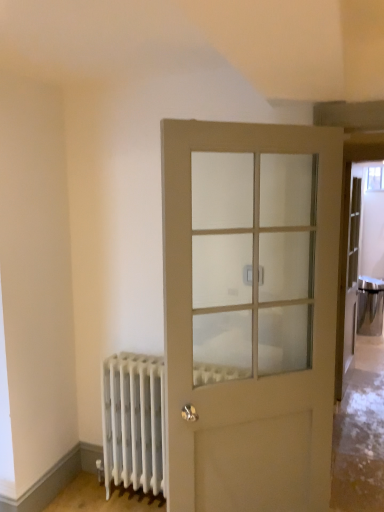
Question: Is white matte radiator at lower left positioned in front of satin silver door handle at center?

Choices:
 (A) yes
 (B) no

Answer: (B)

Question: Is white matte radiator at lower left placed right next to satin silver door handle at center?

Choices:
 (A) no
 (B) yes

Answer: (A)

Question: From a real-world perspective, is white matte radiator at lower left below satin silver door handle at center?

Choices:
 (A) yes
 (B) no

Answer: (A)

Question: From the image's perspective, is white matte radiator at lower left under satin silver door handle at center?

Choices:
 (A) yes
 (B) no

Answer: (A)

Question: From the image's perspective, is white matte radiator at lower left located above satin silver door handle at center?

Choices:
 (A) no
 (B) yes

Answer: (A)

Question: Does white matte radiator at lower left turn towards satin silver door handle at center?

Choices:
 (A) yes
 (B) no

Answer: (B)

Question: From the image's perspective, does matte white door at center appear lower than white matte radiator at lower left?

Choices:
 (A) no
 (B) yes

Answer: (A)

Question: Is matte white door at center positioned far away from white matte radiator at lower left?

Choices:
 (A) no
 (B) yes

Answer: (A)

Question: Does matte white door at center have a greater height compared to white matte radiator at lower left?

Choices:
 (A) yes
 (B) no

Answer: (A)

Question: Would you say matte white door at center is outside white matte radiator at lower left?

Choices:
 (A) no
 (B) yes

Answer: (B)

Question: Is white matte radiator at lower left at the back of matte white door at center?

Choices:
 (A) no
 (B) yes

Answer: (B)

Question: Does matte white door at center have a lesser height compared to white matte radiator at lower left?

Choices:
 (A) no
 (B) yes

Answer: (A)

Question: Is matte white door at center positioned before satin silver door handle at center?

Choices:
 (A) no
 (B) yes

Answer: (B)